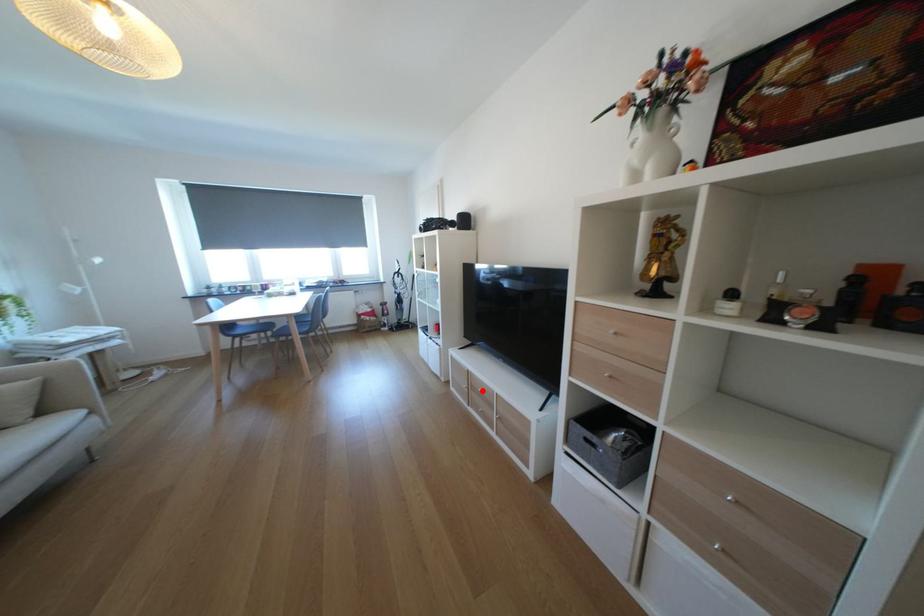
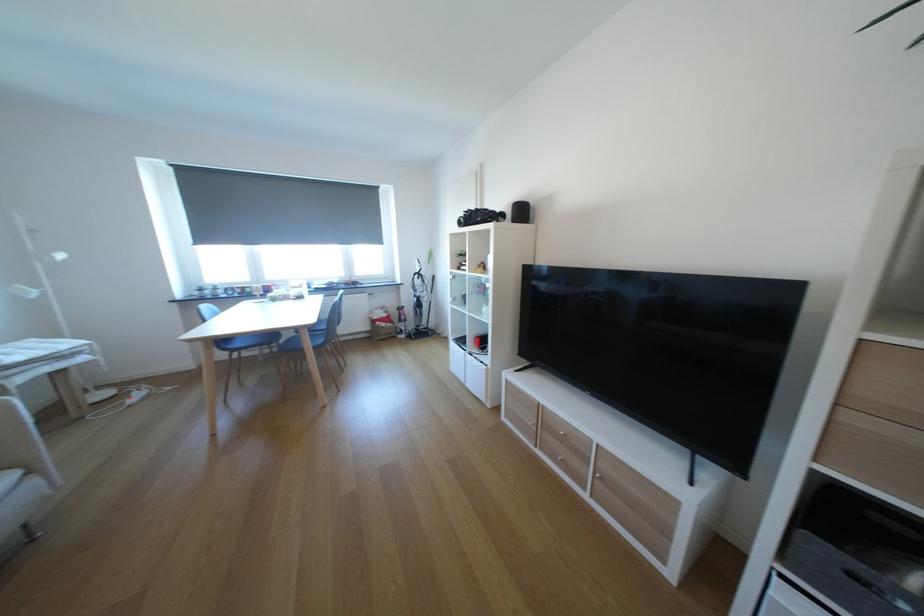
Find the pixel in the second image that matches the highlighted location in the first image.

(553, 429)